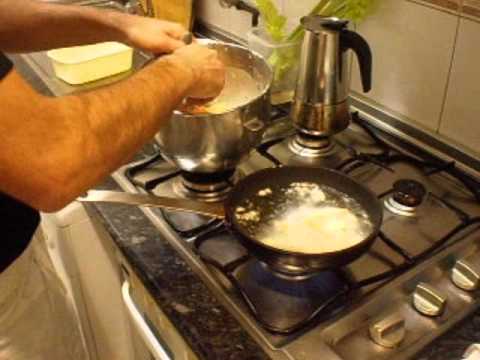
The width and height of the screenshot is (480, 360). I want to click on handle, so click(x=134, y=318).